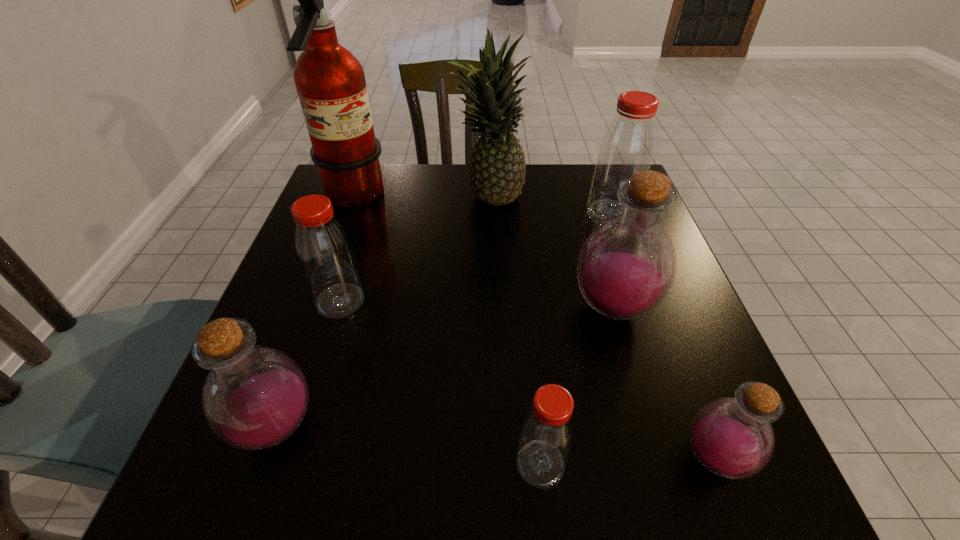
In order to click on vacant space at the right edge in this screenshot , I will do `click(659, 385)`.

Locate an element on the screen. Image resolution: width=960 pixels, height=540 pixels. vacant space at the far left corner of the desktop is located at coordinates (389, 165).

The width and height of the screenshot is (960, 540). What are the coordinates of `free space at the near left corner of the desktop` in the screenshot? It's located at (274, 478).

The image size is (960, 540). I want to click on free spot between the fire extinguisher and the farthest purple bottle, so click(483, 253).

At what (x,y) coordinates should I click in order to perform the action: click on vacant space that's between the biggest red bottle and the smallest purple bottle. Please return your answer as a coordinate pair (x, y). Looking at the image, I should click on (662, 336).

Locate an element on the screen. The width and height of the screenshot is (960, 540). unoccupied area between the second tallest object and the second smallest red bottle is located at coordinates (415, 251).

Locate an element on the screen. free area in between the leftmost purple bottle and the fire extinguisher is located at coordinates (315, 312).

What are the coordinates of `free spot between the leftmost purple bottle and the green pineapple` in the screenshot? It's located at (383, 314).

Where is `vacant area that lies between the biggest red bottle and the second biggest red bottle`? The width and height of the screenshot is (960, 540). vacant area that lies between the biggest red bottle and the second biggest red bottle is located at coordinates (475, 258).

Where is `blank region between the smallest purple bottle and the farthest bottle`? The image size is (960, 540). blank region between the smallest purple bottle and the farthest bottle is located at coordinates (662, 336).